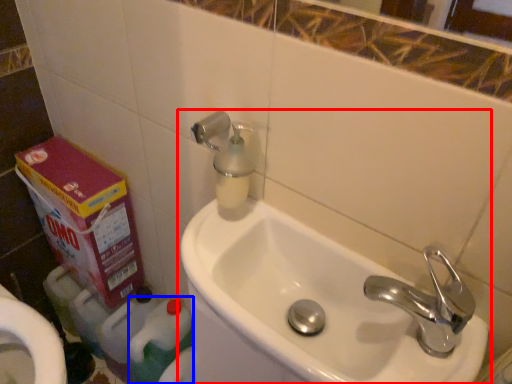
Question: Among these objects, which one is nearest to the camera, sink (highlighted by a red box) or cleaning product (highlighted by a blue box)?

Choices:
 (A) sink
 (B) cleaning product

Answer: (A)